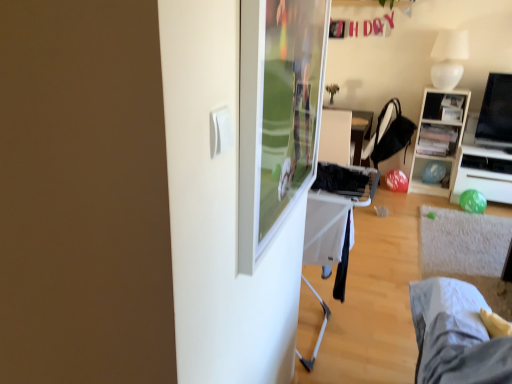
This screenshot has width=512, height=384. I want to click on vacant region in front of wooden shelf at right, so click(x=435, y=201).